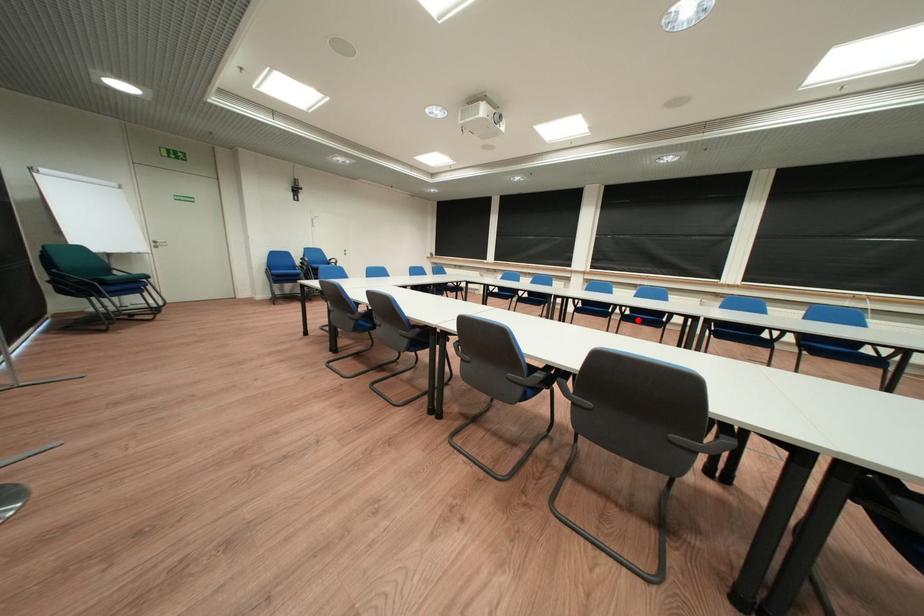
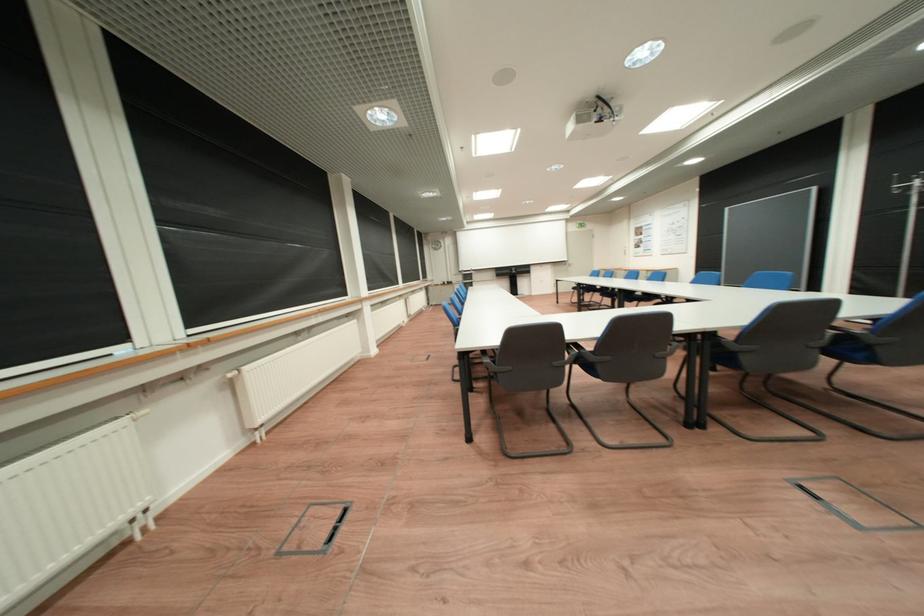
Question: I am providing you with two images of the same scene from different viewpoints. A red point is marked on the first image. Can you still see the location of the red point in image 2?

Choices:
 (A) Yes
 (B) No

Answer: (B)